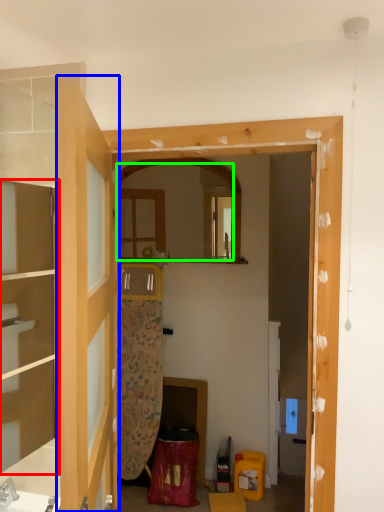
Question: Considering the real-world distances, which object is farthest from cabinetry (highlighted by a red box)? door (highlighted by a blue box) or mirror (highlighted by a green box)?

Choices:
 (A) door
 (B) mirror

Answer: (B)